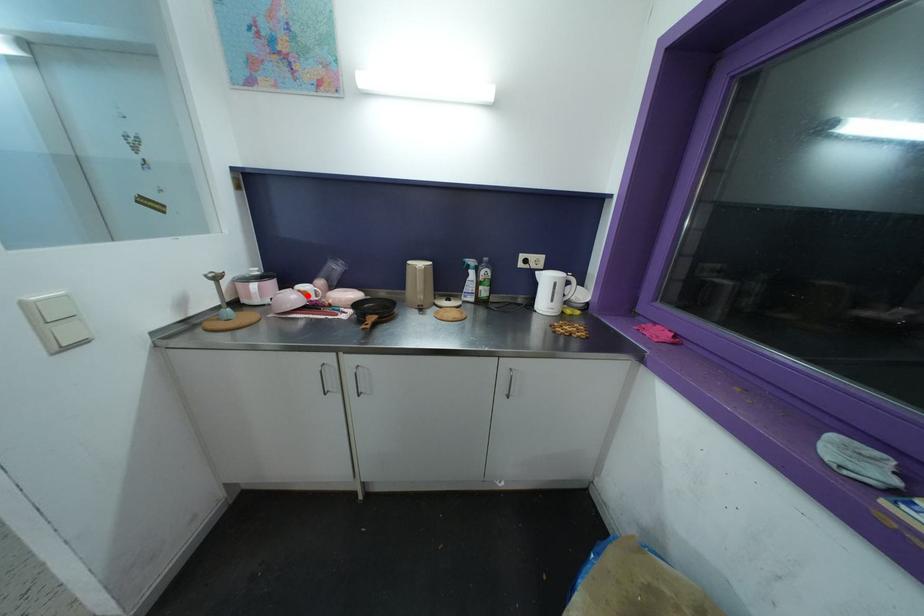
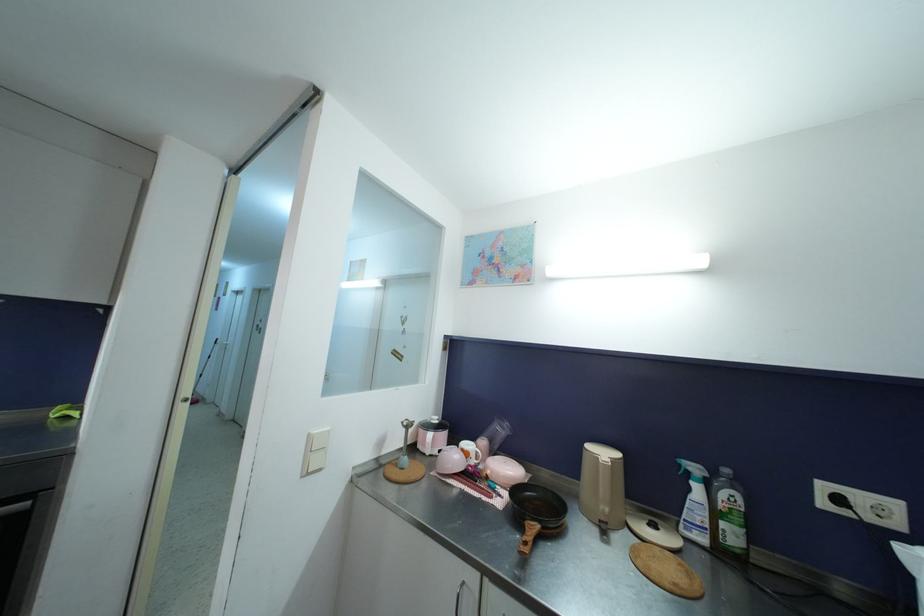
Where in the second image is the point corresponding to the highlighted location from the first image?

(469, 456)